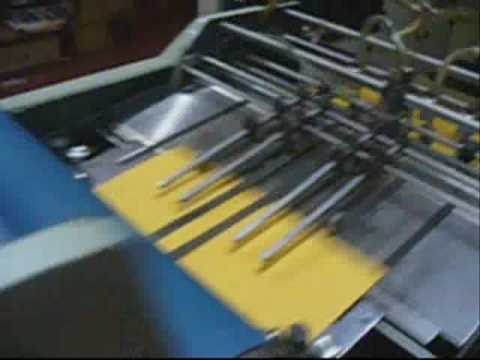
Where is `rod`? The image size is (480, 360). rod is located at coordinates (461, 116).